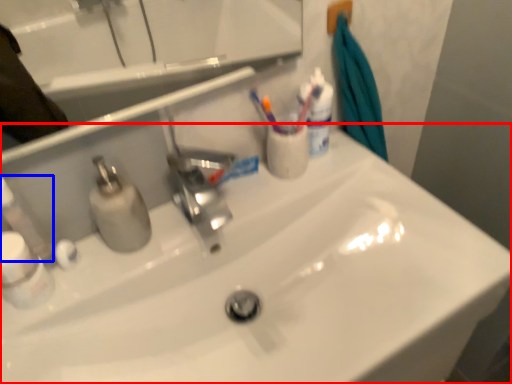
Question: Which object is closer to the camera taking this photo, sink (highlighted by a red box) or toiletry (highlighted by a blue box)?

Choices:
 (A) sink
 (B) toiletry

Answer: (A)